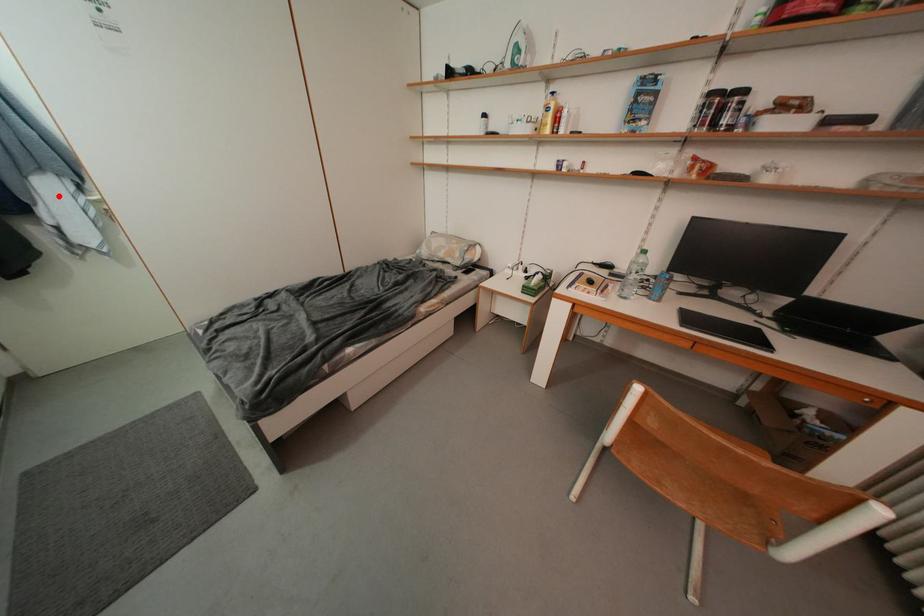
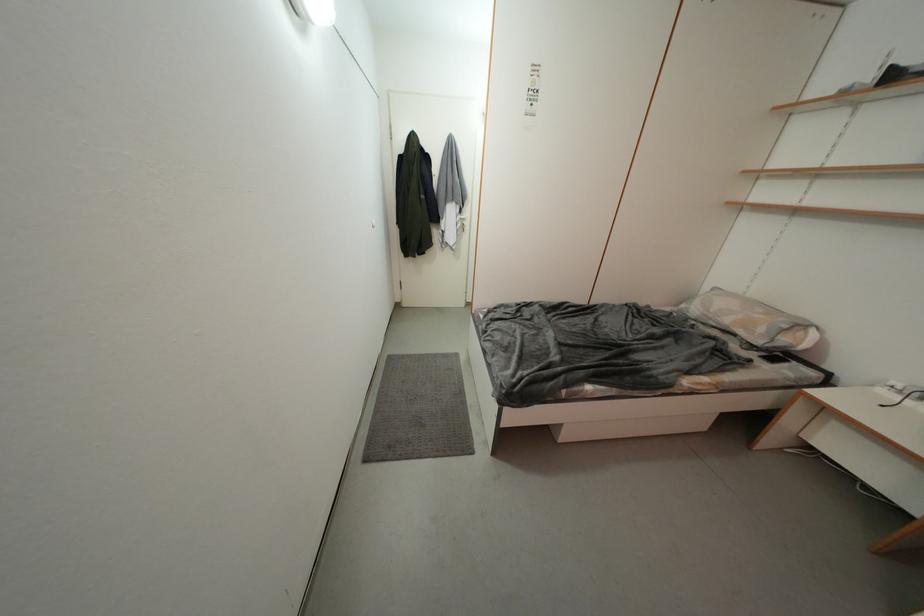
Where in the second image is the point corresponding to the highlighted location from the first image?

(457, 216)